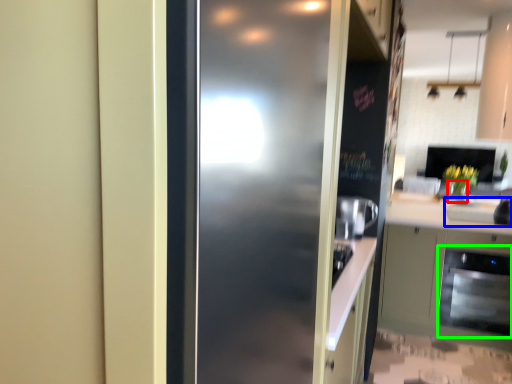
Question: Estimate the real-world distances between objects in this image. Which object is farther from vase (highlighted by a red box), sink (highlighted by a blue box) or dish washer (highlighted by a green box)?

Choices:
 (A) sink
 (B) dish washer

Answer: (B)